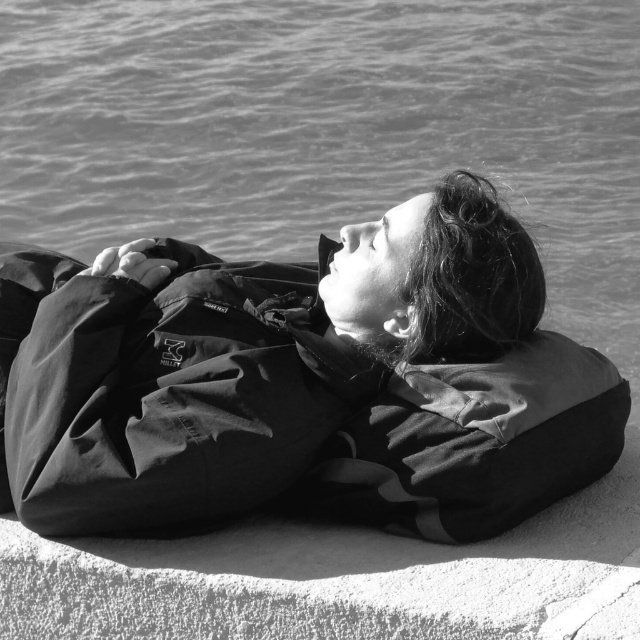
Locate an element on the screen. smooth water at upper center is located at coordinates (330, 129).

Who is shorter, smooth water at upper center or matte black jacket at center?

matte black jacket at center is shorter.

Is point (605, 106) in front of point (77, 289)?

No.

Where is `smooth water at upper center`? smooth water at upper center is located at coordinates (330, 129).